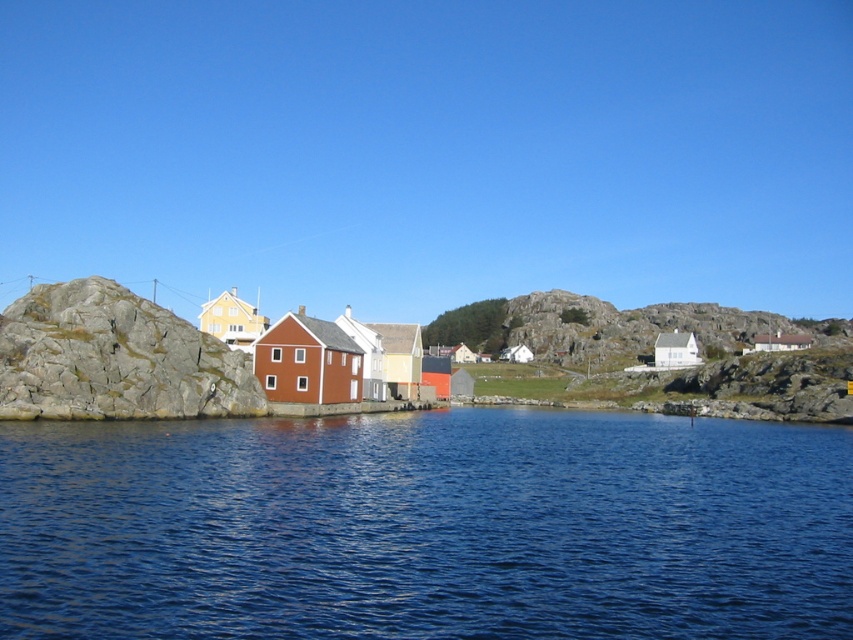
You are standing on the rough textured rock at left and want to get to the blue liquid water at center. Which direction should you move to reach it?

The blue liquid water at center is below the rough textured rock at left, so you should move downward to reach it.